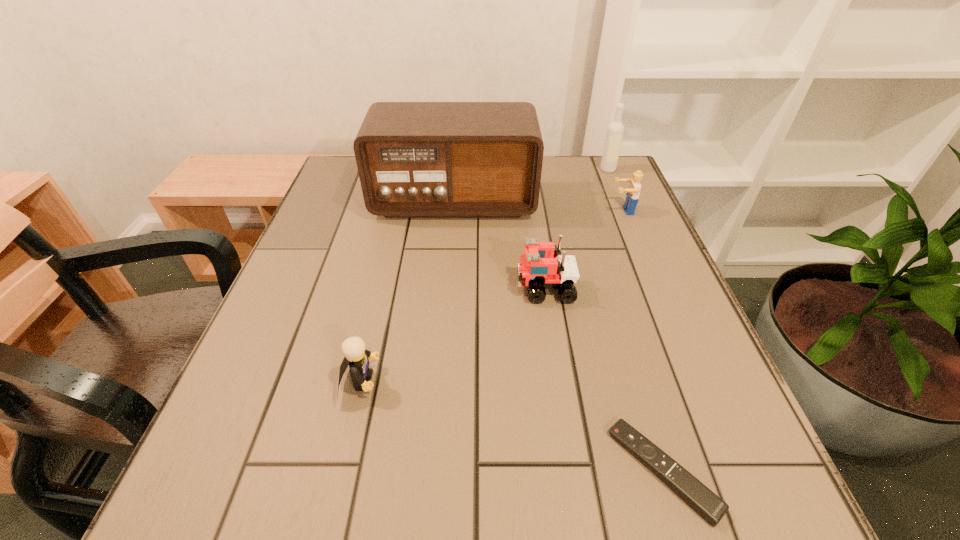
Find the location of `radio receiver situated at the far edge`. radio receiver situated at the far edge is located at coordinates (415, 159).

Locate an element on the screen. vodka that is at the far edge is located at coordinates (615, 130).

You are a GUI agent. You are given a task and a screenshot of the screen. Output one action in this format:
    pyautogui.click(x=<x>, y=<y>)
    Task: Click on the object positioned at the near edge
    
    Given the screenshot: What is the action you would take?
    pyautogui.click(x=707, y=504)

Where is `object that is at the left edge`? object that is at the left edge is located at coordinates (415, 159).

Find the location of a particular element. vodka that is positioned at the right edge is located at coordinates (615, 130).

What are the coordinates of `Lego that is at the right edge` in the screenshot? It's located at (632, 196).

Identify the location of remote control located at the right edge. The height and width of the screenshot is (540, 960). (707, 504).

Identify the location of object that is at the far left corner. 415,159.

Image resolution: width=960 pixels, height=540 pixels. Identify the location of object that is at the far right corner. (615, 130).

This screenshot has width=960, height=540. In order to click on object at the near right corner in this screenshot , I will do `click(707, 504)`.